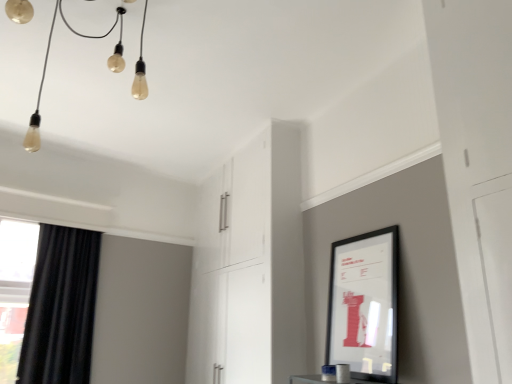
Identify the location of black matte picture frame at upper right. The image size is (512, 384). (364, 305).

In order to click on black matte picture frame at upper right in this screenshot , I will do (x=364, y=305).

Considering the sizes of objects white glossy cabinet at center and black matte picture frame at upper right in the image provided, who is bigger, white glossy cabinet at center or black matte picture frame at upper right?

white glossy cabinet at center.

Locate an element on the screen. Image resolution: width=512 pixels, height=384 pixels. picture frame above the white glossy cabinet at center (from the image's perspective) is located at coordinates (364, 305).

Considering the relative sizes of white glossy cabinet at center and black matte picture frame at upper right in the image provided, is white glossy cabinet at center taller than black matte picture frame at upper right?

Indeed, white glossy cabinet at center has a greater height compared to black matte picture frame at upper right.

Is matte glass lightbulbs at upper left located within black matte picture frame at upper right?

No, black matte picture frame at upper right does not contain matte glass lightbulbs at upper left.

Can you confirm if black matte picture frame at upper right is wider than matte glass lightbulbs at upper left?

No.

Could you measure the distance between black matte picture frame at upper right and matte glass lightbulbs at upper left?

black matte picture frame at upper right is 5.76 feet from matte glass lightbulbs at upper left.

What's the angular difference between black matte picture frame at upper right and matte glass lightbulbs at upper left's facing directions?

11.8 degrees separate the facing orientations of black matte picture frame at upper right and matte glass lightbulbs at upper left.

Is matte glass lightbulbs at upper left oriented away from black matte picture frame at upper right?

No, black matte picture frame at upper right is not at the back of matte glass lightbulbs at upper left.

Who is smaller, matte glass lightbulbs at upper left or black matte picture frame at upper right?

Smaller between the two is black matte picture frame at upper right.

Can you see matte glass lightbulbs at upper left touching black matte picture frame at upper right?

No, matte glass lightbulbs at upper left is not beside black matte picture frame at upper right.

From a real-world perspective, relative to black matte picture frame at upper right, is matte glass lightbulbs at upper left vertically above or below?

In terms of real-world spatial position, matte glass lightbulbs at upper left is above black matte picture frame at upper right.

From the image's perspective, would you say black velvet curtain at left is shown under black matte picture frame at upper right?

Correct, black velvet curtain at left appears lower than black matte picture frame at upper right in the image.

Does black velvet curtain at left have a greater height compared to black matte picture frame at upper right?

Yes, black velvet curtain at left is taller than black matte picture frame at upper right.

How different are the orientations of black velvet curtain at left and black matte picture frame at upper right in degrees?

black velvet curtain at left and black matte picture frame at upper right are facing 102 degrees away from each other.

From the image's perspective, is matte glass lightbulbs at upper left located above or below black velvet curtain at left?

Clearly, from the image's perspective, matte glass lightbulbs at upper left is above black velvet curtain at left.

Who is shorter, matte glass lightbulbs at upper left or black velvet curtain at left?

matte glass lightbulbs at upper left.

Considering the positions of objects matte glass lightbulbs at upper left and black velvet curtain at left in the image provided, who is more to the left, matte glass lightbulbs at upper left or black velvet curtain at left?

From the viewer's perspective, black velvet curtain at left appears more on the left side.

Who is bigger, matte glass lightbulbs at upper left or black velvet curtain at left?

Bigger between the two is matte glass lightbulbs at upper left.

Can you confirm if black velvet curtain at left is shorter than white glossy cabinet at center?

Yes.

Who is smaller, black velvet curtain at left or white glossy cabinet at center?

black velvet curtain at left.

Consider the image. Is black velvet curtain at left looking in the opposite direction of white glossy cabinet at center?

No, black velvet curtain at left is not facing the opposite direction of white glossy cabinet at center.

In terms of width, does black velvet curtain at left look wider or thinner when compared to white glossy cabinet at center?

In the image, black velvet curtain at left appears to be more narrow than white glossy cabinet at center.

How many degrees apart are the facing directions of black velvet curtain at left and matte glass lightbulbs at upper left?

The angle between the facing direction of black velvet curtain at left and the facing direction of matte glass lightbulbs at upper left is 90 degrees.

From the image's perspective, relative to matte glass lightbulbs at upper left, is black velvet curtain at left above or below?

black velvet curtain at left is situated lower than matte glass lightbulbs at upper left in the image.

Would you consider black velvet curtain at left to be distant from matte glass lightbulbs at upper left?

Absolutely, black velvet curtain at left is distant from matte glass lightbulbs at upper left.

Is black velvet curtain at left further to the viewer compared to matte glass lightbulbs at upper left?

That is True.

You are a GUI agent. You are given a task and a screenshot of the screen. Output one action in this format:
    pyautogui.click(x=<x>, y=<y>)
    Task: Click on the dresser below the black matte picture frame at upper right (from the image's perspective)
    This screenshot has width=512, height=384.
    Given the screenshot: What is the action you would take?
    pyautogui.click(x=250, y=265)

Locate an element on the screen. light fixture in front of the black matte picture frame at upper right is located at coordinates (46, 67).

When comparing their distances from black velvet curtain at left, does black matte picture frame at upper right or white glossy cabinet at center seem closer?

white glossy cabinet at center lies closer to black velvet curtain at left than the other object.

From the image, which object appears to be nearer to matte glass lightbulbs at upper left, white glossy cabinet at center or black velvet curtain at left?

Among the two, black velvet curtain at left is located nearer to matte glass lightbulbs at upper left.

Considering their positions, is black matte picture frame at upper right positioned further to black velvet curtain at left than matte glass lightbulbs at upper left?

black matte picture frame at upper right is further to black velvet curtain at left.

Looking at the image, which one is located closer to matte glass lightbulbs at upper left, black matte picture frame at upper right or black velvet curtain at left?

The object closer to matte glass lightbulbs at upper left is black velvet curtain at left.

Based on their spatial positions, is white glossy cabinet at center or black matte picture frame at upper right closer to matte glass lightbulbs at upper left?

Based on the image, white glossy cabinet at center appears to be nearer to matte glass lightbulbs at upper left.

Looking at the image, which one is located further to black velvet curtain at left, white glossy cabinet at center or black matte picture frame at upper right?

black matte picture frame at upper right lies further to black velvet curtain at left than the other object.

When comparing their distances from black matte picture frame at upper right, does black velvet curtain at left or white glossy cabinet at center seem further?

Among the two, black velvet curtain at left is located further to black matte picture frame at upper right.

Based on their spatial positions, is matte glass lightbulbs at upper left or black velvet curtain at left closer to white glossy cabinet at center?

black velvet curtain at left is positioned closer to the anchor white glossy cabinet at center.

Locate an element on the screen. light fixture situated between black velvet curtain at left and black matte picture frame at upper right from left to right is located at coordinates (46, 67).

The image size is (512, 384). Find the location of `dresser between matte glass lightbulbs at upper left and black velvet curtain at left from front to back`. dresser between matte glass lightbulbs at upper left and black velvet curtain at left from front to back is located at coordinates (250, 265).

Image resolution: width=512 pixels, height=384 pixels. I want to click on dresser located between black velvet curtain at left and black matte picture frame at upper right in the left-right direction, so click(250, 265).

The height and width of the screenshot is (384, 512). In order to click on picture frame between matte glass lightbulbs at upper left and white glossy cabinet at center in the front-back direction in this screenshot , I will do `click(364, 305)`.